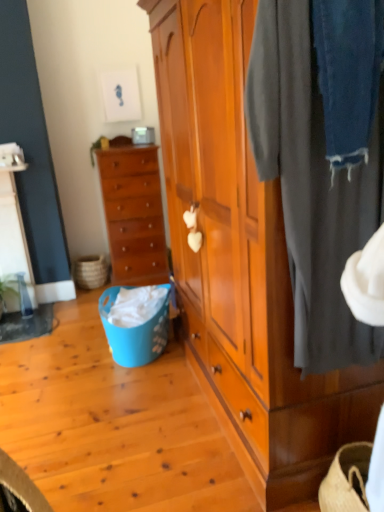
Locate an element on the screen. blue plastic picnic basket at lower left, the 1th picnic basket viewed from the front is located at coordinates (135, 332).

Describe the element at coordinates (310, 187) in the screenshot. I see `dark gray fabric at right` at that location.

Find the location of a particular element. The height and width of the screenshot is (512, 384). wooden chest of drawers at center left is located at coordinates (134, 214).

Is blue plastic picnic basket at lower left, the second picnic basket from the back, to the right of wooden wardrobe at center from the viewer's perspective?

No.

From a real-world perspective, which is physically below, blue plastic picnic basket at lower left, which appears as the first picnic basket when viewed from the right, or wooden wardrobe at center?

blue plastic picnic basket at lower left, which appears as the first picnic basket when viewed from the right, is physically lower.

Is blue plastic picnic basket at lower left, which appears as the first picnic basket when viewed from the right, turned away from wooden wardrobe at center?

No, blue plastic picnic basket at lower left, which appears as the first picnic basket when viewed from the right,'s orientation is not away from wooden wardrobe at center.

Considering the positions of points (83, 274) and (143, 323), is point (83, 274) farther from camera compared to point (143, 323)?

Yes, it is.

Does natural woven picnic basket at lower left, the first picnic basket from the left, have a greater width compared to blue plastic picnic basket at lower left, which ranks as the 2th picnic basket in left-to-right order?

No.

From a real-world perspective, which object rests below the other?

From a 3D spatial view, natural woven picnic basket at lower left, which is the second picnic basket in front-to-back order, is below.

Is natural woven picnic basket at lower left, which is the second picnic basket in front-to-back order, behind blue plastic picnic basket at lower left, the second picnic basket from the back?

Yes, it is behind blue plastic picnic basket at lower left, the second picnic basket from the back.

From the image's perspective, which one is positioned lower, natural woven picnic basket at lower left, which is the second picnic basket in front-to-back order, or wooden wardrobe at center?

natural woven picnic basket at lower left, which is the second picnic basket in front-to-back order, from the image's perspective.

Which is correct: natural woven picnic basket at lower left, which is the 1th picnic basket in back-to-front order, is inside wooden wardrobe at center, or outside of it?

natural woven picnic basket at lower left, which is the 1th picnic basket in back-to-front order, lies outside wooden wardrobe at center.

In the scene shown: Is natural woven picnic basket at lower left, which is counted as the second picnic basket, starting from the right, at the left side of wooden wardrobe at center?

Yes.

The width and height of the screenshot is (384, 512). I want to click on cabinetry in front of the natural woven picnic basket at lower left, which is counted as the second picnic basket, starting from the right, so point(242,262).

Is wooden chest of drawers at center left inside blue plastic picnic basket at lower left, which appears as the first picnic basket when viewed from the right?

No.

Between point (149, 357) and point (97, 154), which one is positioned in front?

Point (149, 357)

Is blue plastic picnic basket at lower left, which appears as the first picnic basket when viewed from the right, directly adjacent to wooden chest of drawers at center left?

→ blue plastic picnic basket at lower left, which appears as the first picnic basket when viewed from the right, and wooden chest of drawers at center left are not in contact.

Does point (154, 154) lie in front of point (249, 114)?

No, (154, 154) is behind (249, 114).

Who is smaller, wooden chest of drawers at center left or dark gray fabric at right?

Smaller between the two is dark gray fabric at right.

Which object is wider, wooden wardrobe at center or blue plastic picnic basket at lower left, which ranks as the 2th picnic basket in left-to-right order?

wooden wardrobe at center.

Which point is more forward, (288, 285) or (154, 349)?

The point (288, 285) is closer to the camera.

How different are the orientations of wooden wardrobe at center and blue plastic picnic basket at lower left, the 1th picnic basket viewed from the front, in degrees?

They differ by 49.8 degrees in their facing directions.

From a real-world perspective, does wooden wardrobe at center sit lower than blue plastic picnic basket at lower left, the 1th picnic basket viewed from the front?

No, from a real-world perspective, wooden wardrobe at center is not under blue plastic picnic basket at lower left, the 1th picnic basket viewed from the front.

In the image, is dark gray fabric at right positioned in front of or behind wooden chest of drawers at center left?

Clearly, dark gray fabric at right is in front of wooden chest of drawers at center left.

Are dark gray fabric at right and wooden chest of drawers at center left making contact?

dark gray fabric at right is not next to wooden chest of drawers at center left, and they're not touching.

Which is less distant, [312,326] or [120,178]?

Point [312,326]

From a real-world perspective, is dark gray fabric at right located higher than wooden chest of drawers at center left?

Yes, from a real-world perspective, dark gray fabric at right is on top of wooden chest of drawers at center left.

There is a blue plastic picnic basket at lower left, the second picnic basket from the back. What are the coordinates of `cabinetry above it (from a real-world perspective)` in the screenshot? It's located at (242, 262).

I want to click on picnic basket lying on the right of natural woven picnic basket at lower left, which is the 1th picnic basket in back-to-front order, so click(135, 332).

When comparing their distances from dark gray fabric at right, does blue plastic picnic basket at lower left, the 1th picnic basket viewed from the front, or wooden chest of drawers at center left seem further?

Among the two, wooden chest of drawers at center left is located further to dark gray fabric at right.

From the image, which object appears to be nearer to dark gray fabric at right, wooden wardrobe at center or wooden chest of drawers at center left?

Among the two, wooden wardrobe at center is located nearer to dark gray fabric at right.

When comparing their distances from natural woven picnic basket at lower left, which is the 1th picnic basket in back-to-front order, does dark gray fabric at right or wooden wardrobe at center seem closer?

wooden wardrobe at center.

Considering their positions, is blue plastic picnic basket at lower left, the 1th picnic basket viewed from the front, positioned closer to dark gray fabric at right than natural woven picnic basket at lower left, which is the second picnic basket in front-to-back order?

blue plastic picnic basket at lower left, the 1th picnic basket viewed from the front, is closer to dark gray fabric at right.

When comparing their distances from wooden chest of drawers at center left, does wooden wardrobe at center or natural woven picnic basket at lower left, which is the 1th picnic basket in back-to-front order, seem further?

wooden wardrobe at center lies further to wooden chest of drawers at center left than the other object.

From the picture: Which object lies further to the anchor point natural woven picnic basket at lower left, which is the 1th picnic basket in back-to-front order, wooden chest of drawers at center left or wooden wardrobe at center?

wooden wardrobe at center.

When comparing their distances from natural woven picnic basket at lower left, which is the second picnic basket in front-to-back order, does dark gray fabric at right or wooden chest of drawers at center left seem further?

dark gray fabric at right is positioned further to the anchor natural woven picnic basket at lower left, which is the second picnic basket in front-to-back order.

From the picture: When comparing their distances from wooden chest of drawers at center left, does natural woven picnic basket at lower left, the first picnic basket from the left, or wooden wardrobe at center seem closer?

natural woven picnic basket at lower left, the first picnic basket from the left, is closer to wooden chest of drawers at center left.

The image size is (384, 512). Identify the location of picnic basket between wooden wardrobe at center and natural woven picnic basket at lower left, which is the second picnic basket in front-to-back order, along the z-axis. (135, 332).

Where is `clothing positioned between wooden wardrobe at center and blue plastic picnic basket at lower left, which ranks as the 2th picnic basket in left-to-right order, from near to far`? clothing positioned between wooden wardrobe at center and blue plastic picnic basket at lower left, which ranks as the 2th picnic basket in left-to-right order, from near to far is located at coordinates (310, 187).

The width and height of the screenshot is (384, 512). Identify the location of picnic basket between dark gray fabric at right and wooden chest of drawers at center left from front to back. (135, 332).

Where is `the chest of drawers located between dark gray fabric at right and natural woven picnic basket at lower left, which is the 1th picnic basket in back-to-front order, in the depth direction`? This screenshot has height=512, width=384. the chest of drawers located between dark gray fabric at right and natural woven picnic basket at lower left, which is the 1th picnic basket in back-to-front order, in the depth direction is located at coordinates (134, 214).